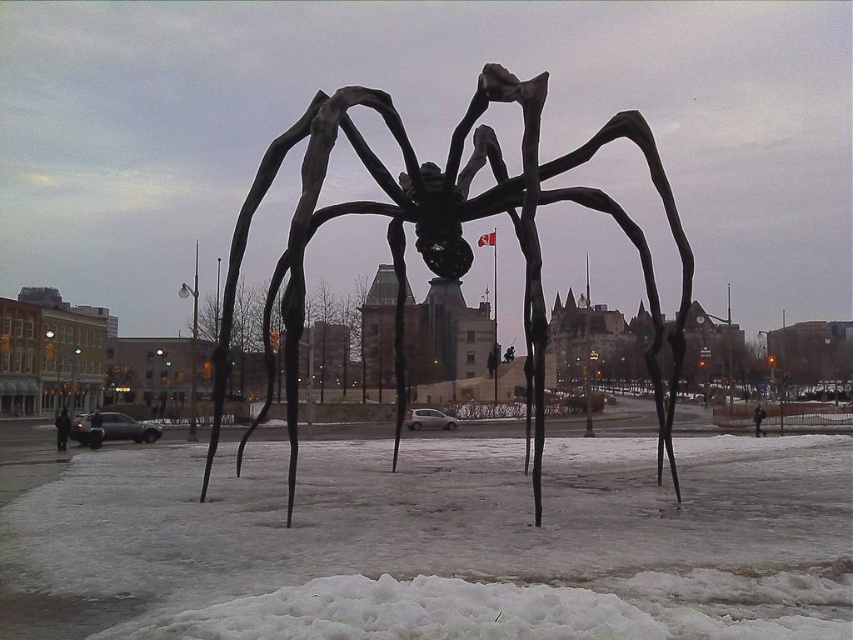
You are an artist planning to place a new sculpture in the plaza. You want to ensure that the new sculpture will be taller than the existing white powdery snow at center but shorter than the black matte spider at center. Is this possible?

The white powdery snow at center has a lesser height compared to black matte spider at center. Therefore, it is possible to create a new sculpture taller than the white powdery snow at center but shorter than the black matte spider at center by ensuring its height is between the two.